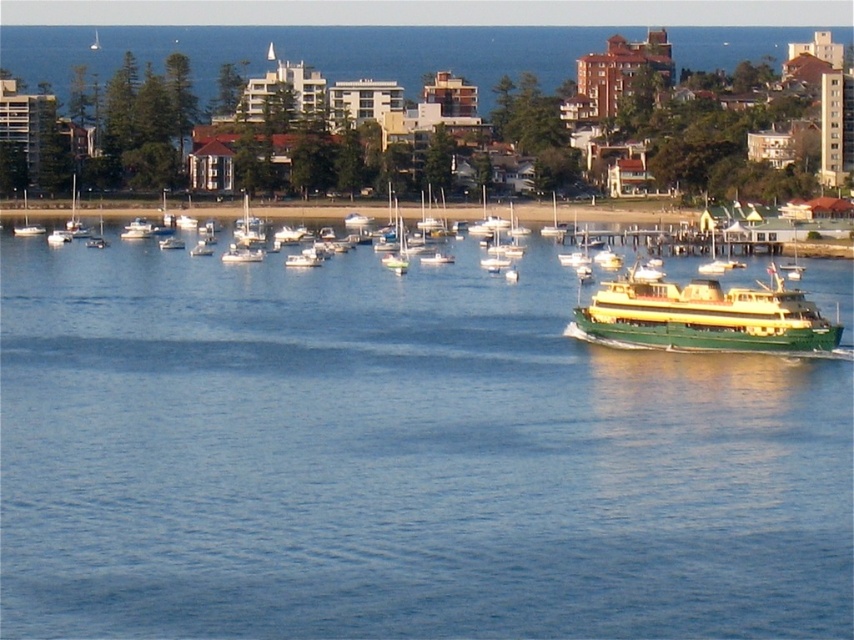
Who is higher up, white glossy sailboat at center-left or white matte sailboat at left?

white matte sailboat at left is above.

What do you see at coordinates (241, 253) in the screenshot? I see `white glossy sailboat at center-left` at bounding box center [241, 253].

Is point (254, 252) positioned before point (26, 234)?

Yes, point (254, 252) is closer to viewer.

The image size is (854, 640). What are the coordinates of `white glossy sailboat at center-left` in the screenshot? It's located at (241, 253).

Is green polished ferry at right taller than white matte sailboat at left?

Indeed, green polished ferry at right has a greater height compared to white matte sailboat at left.

Does green polished ferry at right have a greater width compared to white matte sailboat at left?

Yes, green polished ferry at right is wider than white matte sailboat at left.

Is point (700, 330) more distant than point (42, 232)?

No, it is not.

Where is `green polished ferry at right`? This screenshot has height=640, width=854. green polished ferry at right is located at coordinates pos(706,317).

Is blue water at center thinner than white matte sailboat at left?

Incorrect, blue water at center's width is not less than white matte sailboat at left's.

Does blue water at center have a greater width compared to white matte sailboat at left?

Indeed, blue water at center has a greater width compared to white matte sailboat at left.

Which is in front, point (431, 499) or point (22, 193)?

Point (431, 499)

Find the location of a particular element. The width and height of the screenshot is (854, 640). blue water at center is located at coordinates [396, 458].